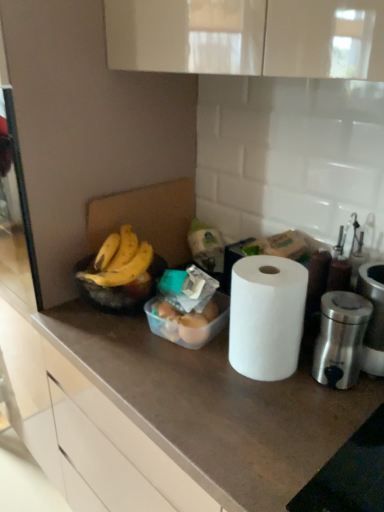
This screenshot has height=512, width=384. Find the location of `space that is in front of white matte paper towel at center`. space that is in front of white matte paper towel at center is located at coordinates pyautogui.click(x=274, y=422).